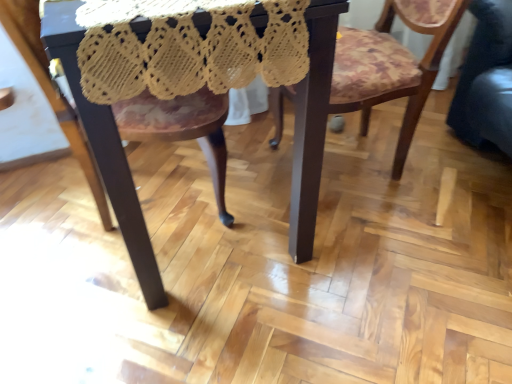
Question: Does wooden floral-patterned chair at center, acting as the second chair starting from the left, have a larger size compared to dark brown polished wood table at center?

Choices:
 (A) no
 (B) yes

Answer: (A)

Question: From the image's perspective, is wooden floral-patterned chair at center, the first chair viewed from the right, on top of dark brown polished wood table at center?

Choices:
 (A) yes
 (B) no

Answer: (A)

Question: Is wooden floral-patterned chair at center, acting as the second chair starting from the left, positioned in front of dark brown polished wood table at center?

Choices:
 (A) no
 (B) yes

Answer: (A)

Question: From a real-world perspective, does wooden floral-patterned chair at center, acting as the second chair starting from the left, sit lower than dark brown polished wood table at center?

Choices:
 (A) no
 (B) yes

Answer: (B)

Question: Is wooden floral-patterned chair at center, acting as the second chair starting from the left, directly adjacent to dark brown polished wood table at center?

Choices:
 (A) no
 (B) yes

Answer: (A)

Question: Is wooden floral-patterned chair at center, acting as the second chair starting from the left, far away from dark brown polished wood table at center?

Choices:
 (A) no
 (B) yes

Answer: (A)

Question: Is dark brown polished wood table at center at the right side of wooden floral-patterned chair at center, acting as the second chair starting from the left?

Choices:
 (A) yes
 (B) no

Answer: (B)

Question: Considering the relative sizes of dark brown polished wood table at center and wooden floral-patterned chair at center, the first chair viewed from the right, in the image provided, is dark brown polished wood table at center wider than wooden floral-patterned chair at center, the first chair viewed from the right,?

Choices:
 (A) no
 (B) yes

Answer: (B)

Question: Considering the relative sizes of dark brown polished wood table at center and wooden floral-patterned chair at center, the first chair viewed from the right, in the image provided, is dark brown polished wood table at center bigger than wooden floral-patterned chair at center, the first chair viewed from the right,?

Choices:
 (A) yes
 (B) no

Answer: (A)

Question: Is dark brown polished wood table at center facing towards wooden floral-patterned chair at center, acting as the second chair starting from the left?

Choices:
 (A) yes
 (B) no

Answer: (B)

Question: Considering the relative positions of dark brown polished wood table at center and wooden floral-patterned chair at center, acting as the second chair starting from the left, in the image provided, is dark brown polished wood table at center behind wooden floral-patterned chair at center, acting as the second chair starting from the left,?

Choices:
 (A) no
 (B) yes

Answer: (A)

Question: Are dark brown polished wood table at center and wooden floral-patterned chair at center, the first chair viewed from the right, making contact?

Choices:
 (A) no
 (B) yes

Answer: (A)

Question: Considering the relative positions of dark brown polished wood table at center and wooden chair at center, acting as the second chair starting from the right, in the image provided, is dark brown polished wood table at center to the left of wooden chair at center, acting as the second chair starting from the right, from the viewer's perspective?

Choices:
 (A) no
 (B) yes

Answer: (A)